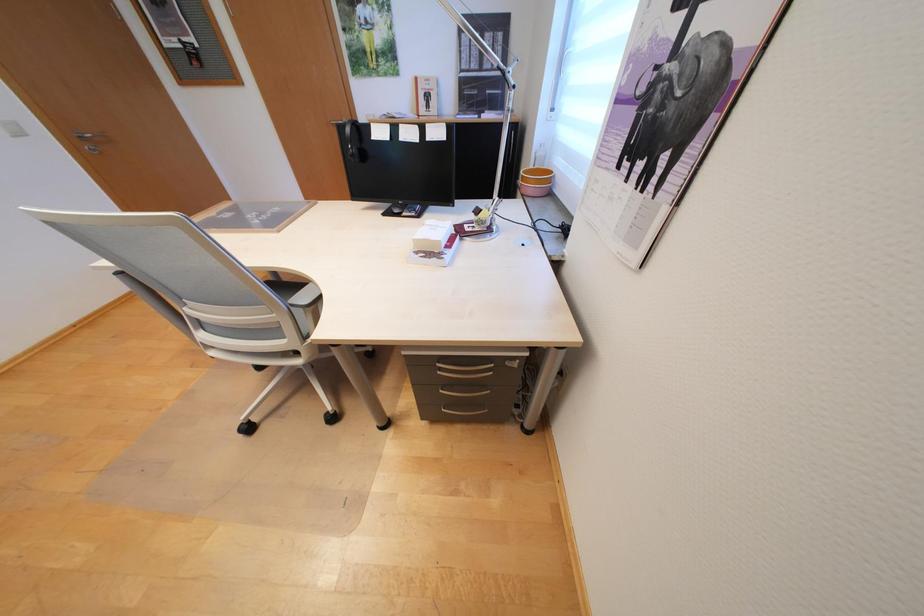
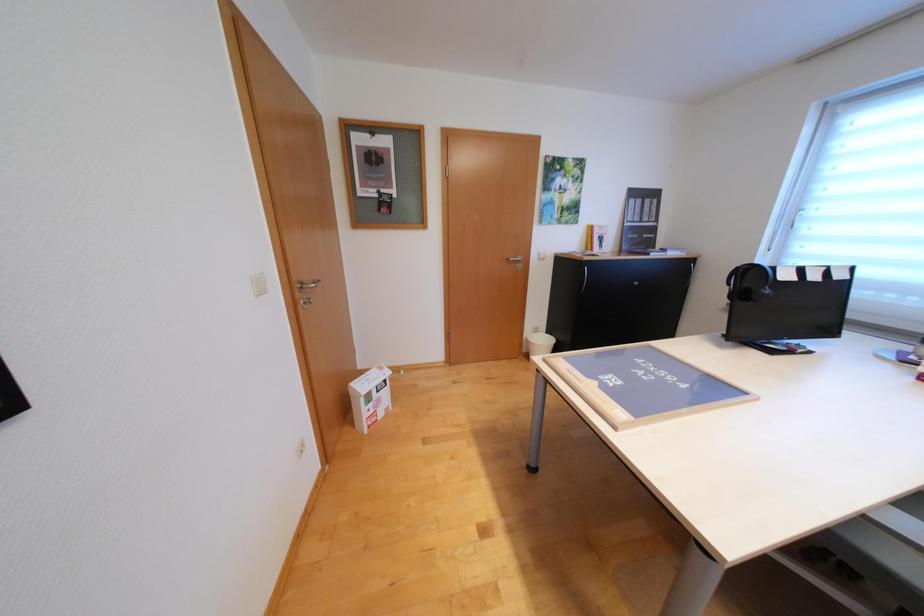
Question: The images are taken continuously from a first-person perspective. In which direction are you moving?

Choices:
 (A) Left
 (B) Right
 (C) Forward
 (D) Backward

Answer: (A)